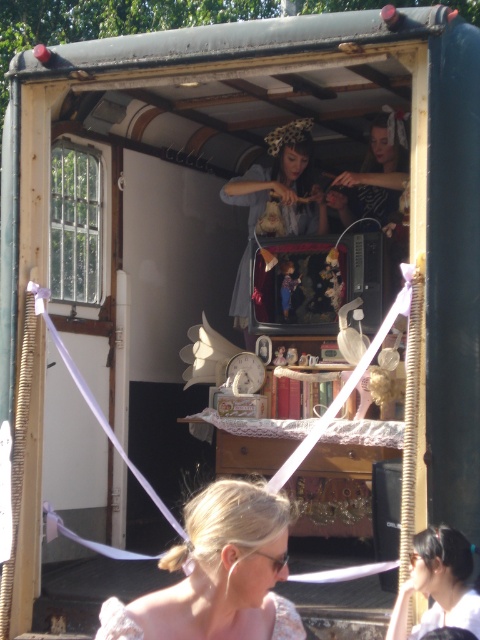
Is blonde hair at center further to the viewer compared to matte gray dress at center?

No, it is in front of matte gray dress at center.

Does blonde hair at center have a lesser width compared to matte gray dress at center?

Incorrect, blonde hair at center's width is not less than matte gray dress at center's.

The height and width of the screenshot is (640, 480). What are the coordinates of `blonde hair at center` in the screenshot? It's located at (217, 573).

At what (x,y) coordinates should I click in order to perform the action: click on blonde hair at center. Please return your answer as a coordinate pair (x, y). The width and height of the screenshot is (480, 640). Looking at the image, I should click on (217, 573).